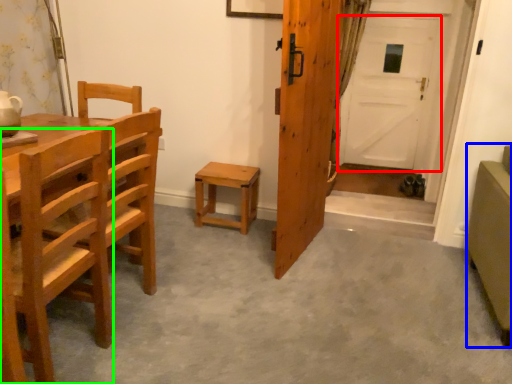
Question: Which object is positioned closest to door (highlighted by a red box)? Select from armchair (highlighted by a blue box) and chair (highlighted by a green box).

Choices:
 (A) armchair
 (B) chair

Answer: (A)